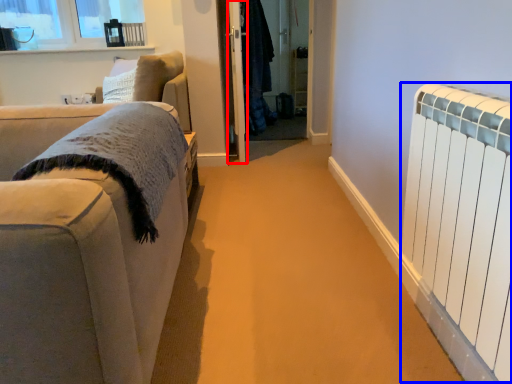
Question: Among these objects, which one is nearest to the camera, screen door (highlighted by a red box) or radiator (highlighted by a blue box)?

Choices:
 (A) screen door
 (B) radiator

Answer: (B)